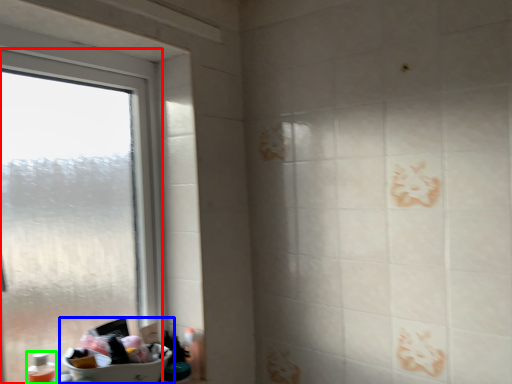
Question: Which object is the closest to the window (highlighted by a red box)? Choose among these: sink (highlighted by a blue box) or toiletry (highlighted by a green box).

Choices:
 (A) sink
 (B) toiletry

Answer: (A)